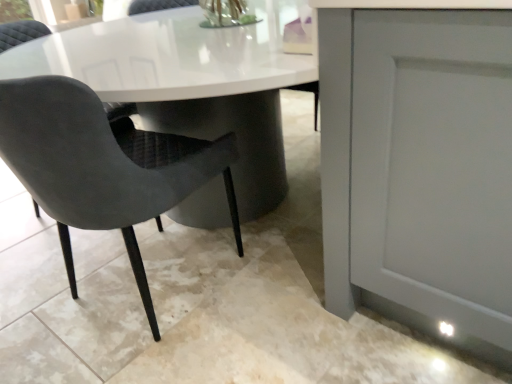
Identify the location of vacant space underneath suede gray chair at lower left (from a real-world perspective). (138, 294).